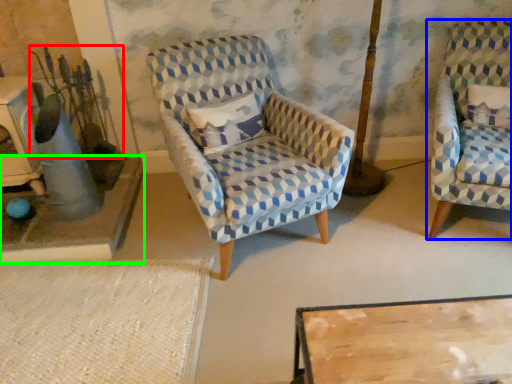
Question: Estimate the real-world distances between objects in this image. Which object is farther from plant (highlighted by a red box), chair (highlighted by a blue box) or table (highlighted by a green box)?

Choices:
 (A) chair
 (B) table

Answer: (A)